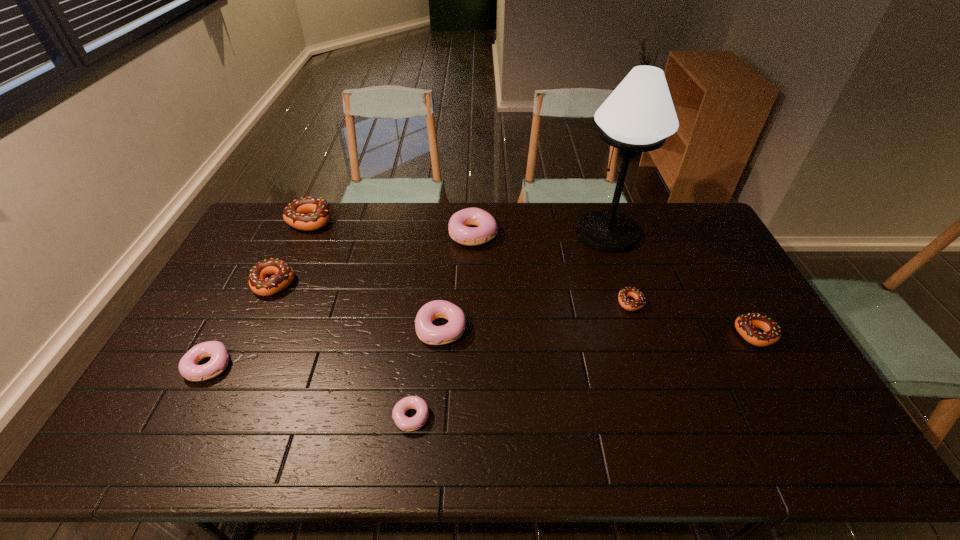
The image size is (960, 540). I want to click on the smallest brown doughnut, so click(631, 305).

The width and height of the screenshot is (960, 540). I want to click on the nearest doughnut, so click(405, 423).

Where is `the nearest purple doughnut`? Image resolution: width=960 pixels, height=540 pixels. the nearest purple doughnut is located at coordinates (405, 423).

At what (x,y) coordinates should I click in order to perform the action: click on vacant area located on the right of the tallest object. Please return your answer as a coordinate pair (x, y). This screenshot has height=540, width=960. Looking at the image, I should click on (677, 233).

You are a GUI agent. You are given a task and a screenshot of the screen. Output one action in this format:
    pyautogui.click(x=<x>, y=<y>)
    Task: Click on the vacant space located on the right of the farthest brown doughnut
    The height and width of the screenshot is (540, 960).
    Given the screenshot: What is the action you would take?
    pyautogui.click(x=428, y=221)

At what (x,y) coordinates should I click in order to perform the action: click on free point located on the right of the biggest purple doughnut. Please return your answer as a coordinate pair (x, y). Looking at the image, I should click on (x=564, y=234).

At what (x,y) coordinates should I click in order to perform the action: click on blank space located 0.120m on the right of the second biggest brown doughnut. Please return your answer as a coordinate pair (x, y). The height and width of the screenshot is (540, 960). Looking at the image, I should click on [x=332, y=283].

Locate an element on the screen. The height and width of the screenshot is (540, 960). vacant space positioned on the right of the third smallest purple doughnut is located at coordinates (564, 329).

Identify the location of vacant point located on the front of the nearest brown doughnut. This screenshot has height=540, width=960. (777, 370).

I want to click on vacant point located on the back of the leftmost purple doughnut, so click(247, 294).